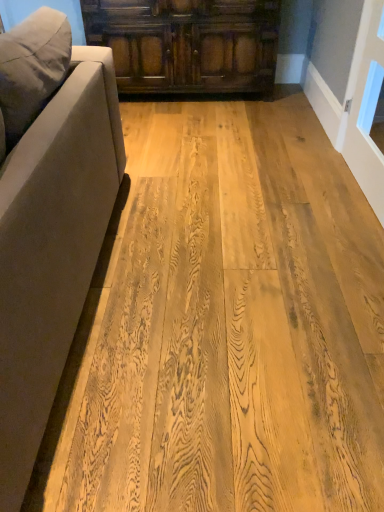
Question: Does natural wood floor at center have a lesser height compared to dark brown wood cabinet at upper center?

Choices:
 (A) no
 (B) yes

Answer: (B)

Question: From a real-world perspective, does natural wood floor at center stand above dark brown wood cabinet at upper center?

Choices:
 (A) no
 (B) yes

Answer: (A)

Question: From the image's perspective, is natural wood floor at center on dark brown wood cabinet at upper center?

Choices:
 (A) yes
 (B) no

Answer: (B)

Question: From the image's perspective, would you say natural wood floor at center is shown under dark brown wood cabinet at upper center?

Choices:
 (A) no
 (B) yes

Answer: (B)

Question: Can you confirm if natural wood floor at center is smaller than dark brown wood cabinet at upper center?

Choices:
 (A) yes
 (B) no

Answer: (A)

Question: Is natural wood floor at center surrounding dark brown wood cabinet at upper center?

Choices:
 (A) yes
 (B) no

Answer: (B)

Question: Can you confirm if dark brown wood cabinet at upper center is shorter than suede-like beige couch at left?

Choices:
 (A) no
 (B) yes

Answer: (B)

Question: Is dark brown wood cabinet at upper center at the right side of suede-like beige couch at left?

Choices:
 (A) no
 (B) yes

Answer: (B)

Question: Is dark brown wood cabinet at upper center facing away from suede-like beige couch at left?

Choices:
 (A) yes
 (B) no

Answer: (B)

Question: From the image's perspective, is dark brown wood cabinet at upper center on top of suede-like beige couch at left?

Choices:
 (A) yes
 (B) no

Answer: (A)

Question: Does dark brown wood cabinet at upper center have a larger size compared to suede-like beige couch at left?

Choices:
 (A) yes
 (B) no

Answer: (B)

Question: Is dark brown wood cabinet at upper center further to the viewer compared to suede-like beige couch at left?

Choices:
 (A) yes
 (B) no

Answer: (A)

Question: Is suede-like beige couch at left outside of dark brown wood cabinet at upper center?

Choices:
 (A) no
 (B) yes

Answer: (B)